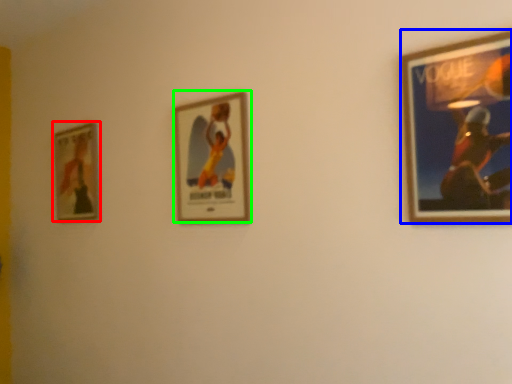
Question: Estimate the real-world distances between objects in this image. Which object is farther from picture frame (highlighted by a red box), picture frame (highlighted by a blue box) or picture frame (highlighted by a green box)?

Choices:
 (A) picture frame
 (B) picture frame

Answer: (A)